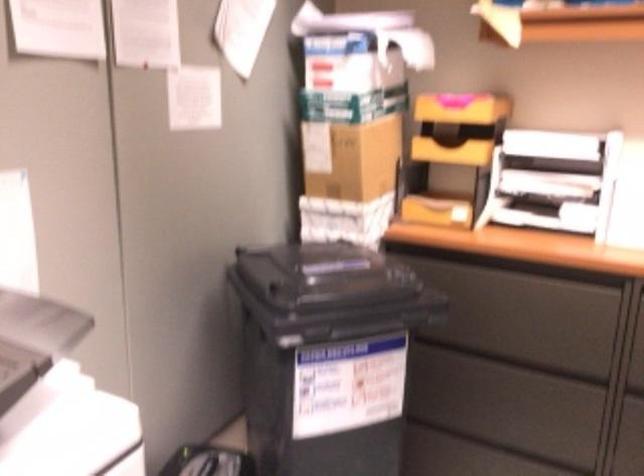
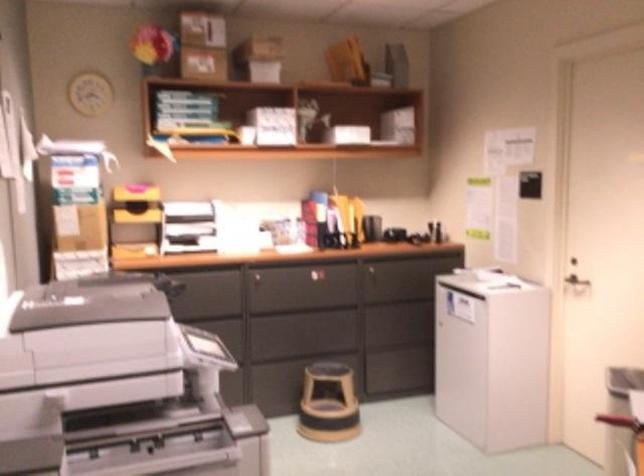
The point at (337, 150) is marked in the first image. Where is the corresponding point in the second image?

(78, 227)